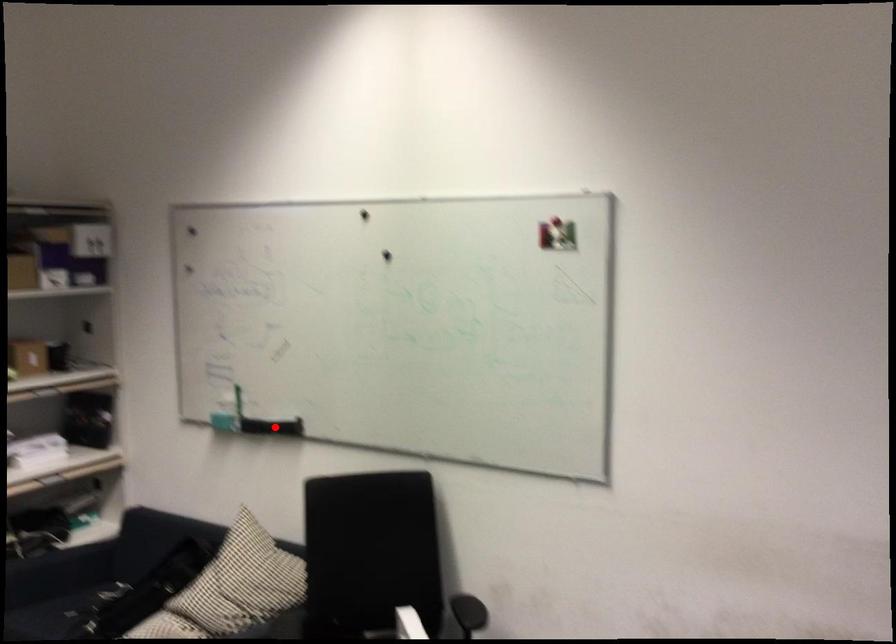
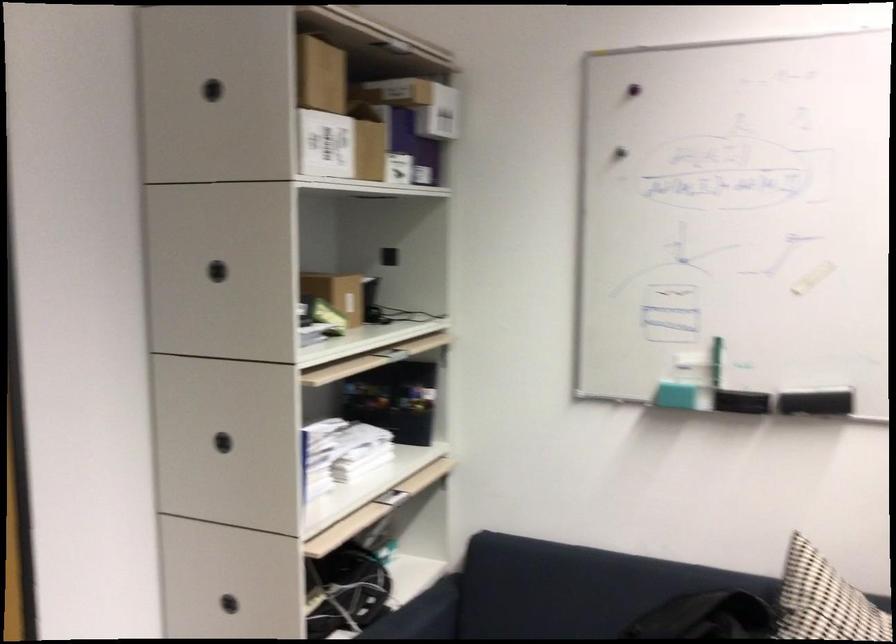
The point at the highlighted location is marked in the first image. Where is the corresponding point in the second image?

(815, 402)